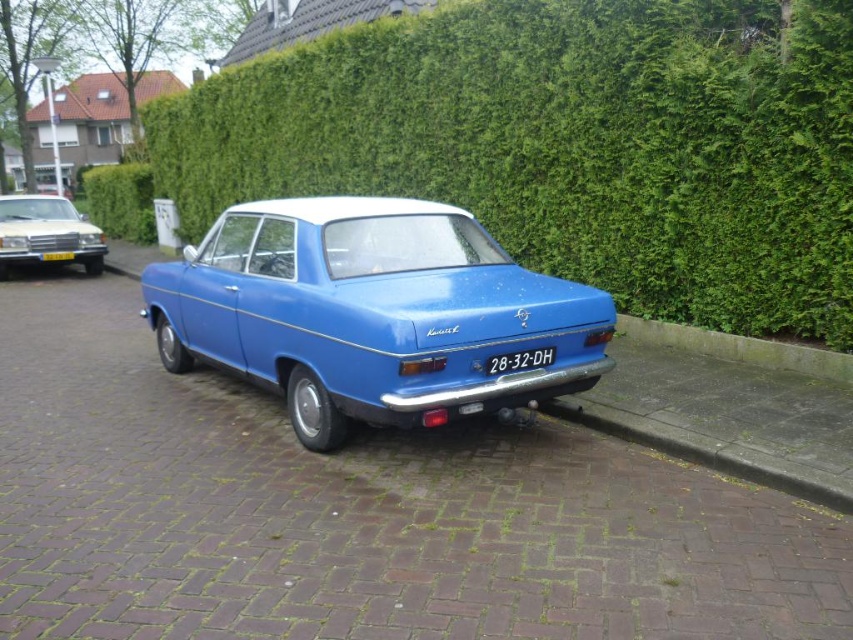
Question: Considering the relative positions of blue glossy sedan at center and matte silver car at left in the image provided, where is blue glossy sedan at center located with respect to matte silver car at left?

Choices:
 (A) below
 (B) above

Answer: (A)

Question: Observing the image, what is the correct spatial positioning of green leafy hedge at upper center in reference to blue glossy sedan at center?

Choices:
 (A) above
 (B) below

Answer: (A)

Question: Can you confirm if green leafy hedge at upper center is smaller than white plastic license plate at center?

Choices:
 (A) yes
 (B) no

Answer: (B)

Question: Which of these objects is positioned closest to the blue glossy sedan at center?

Choices:
 (A) matte silver car at left
 (B) yellow plastic license plate at center
 (C) green leafy hedge at upper center
 (D) white plastic license plate at center

Answer: (D)

Question: Which of the following is the farthest from the observer?

Choices:
 (A) blue glossy sedan at center
 (B) matte silver car at left

Answer: (B)

Question: Which point is closer to the camera?

Choices:
 (A) (88, 257)
 (B) (56, 253)
 (C) (544, 355)

Answer: (C)